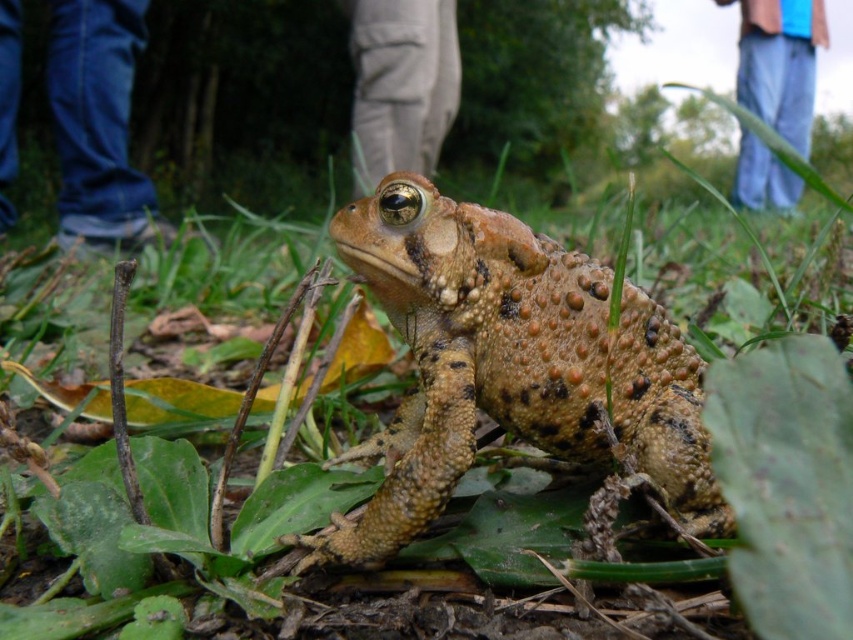
Question: In this image, where is spotted brown skin frog at center located relative to khaki cotton pants at center?

Choices:
 (A) above
 (B) below

Answer: (B)

Question: Can you confirm if spotted brown skin frog at center is bigger than blue jeans at upper right?

Choices:
 (A) no
 (B) yes

Answer: (A)

Question: Estimate the real-world distances between objects in this image. Which object is farther from the blue denim jeans at lower left?

Choices:
 (A) blue jeans at upper right
 (B) khaki cotton pants at center

Answer: (A)

Question: Among these points, which one is farthest from the camera?

Choices:
 (A) (427, 72)
 (B) (469, 371)
 (C) (758, 100)
 (D) (115, 56)

Answer: (C)

Question: Which object is the farthest from the spotted brown skin frog at center?

Choices:
 (A) blue jeans at upper right
 (B) blue denim jeans at lower left
 (C) khaki cotton pants at center

Answer: (A)

Question: Does blue denim jeans at lower left have a larger size compared to blue jeans at upper right?

Choices:
 (A) no
 (B) yes

Answer: (B)